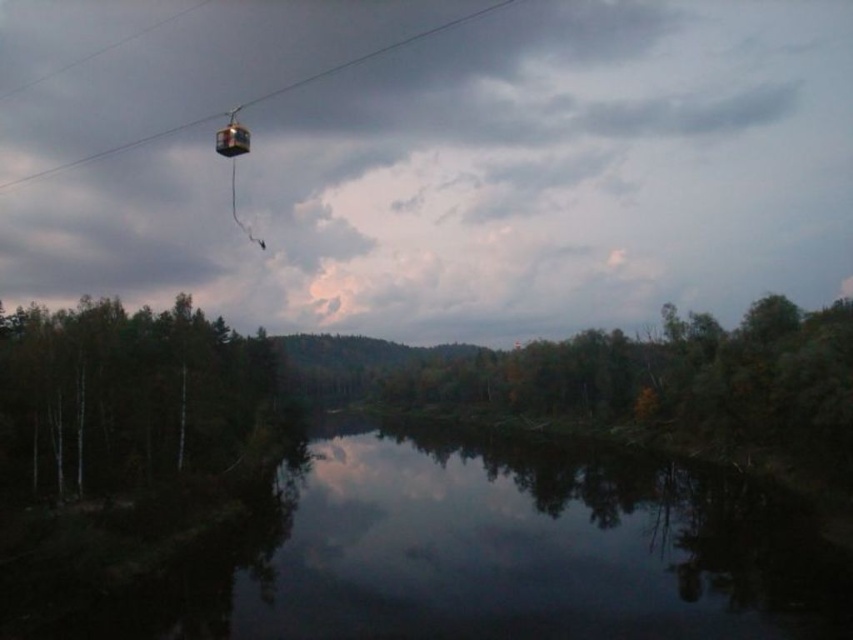
You are standing on the shore of the lake and see the green matte tree at left and the metal cable car at upper center. Which object is closer to the water surface?

The green matte tree at left is closer to the water surface because it is located below the metal cable car at upper center, meaning it is positioned lower in the scene.

You are a photographer trying to capture the metal cable car at upper center and the green matte tree at left in the same frame. Based on their positions, which object is closer to the left edge of the photo?

The metal cable car at upper center is closer to the left edge of the photo because the green matte tree at left is to the right of it.